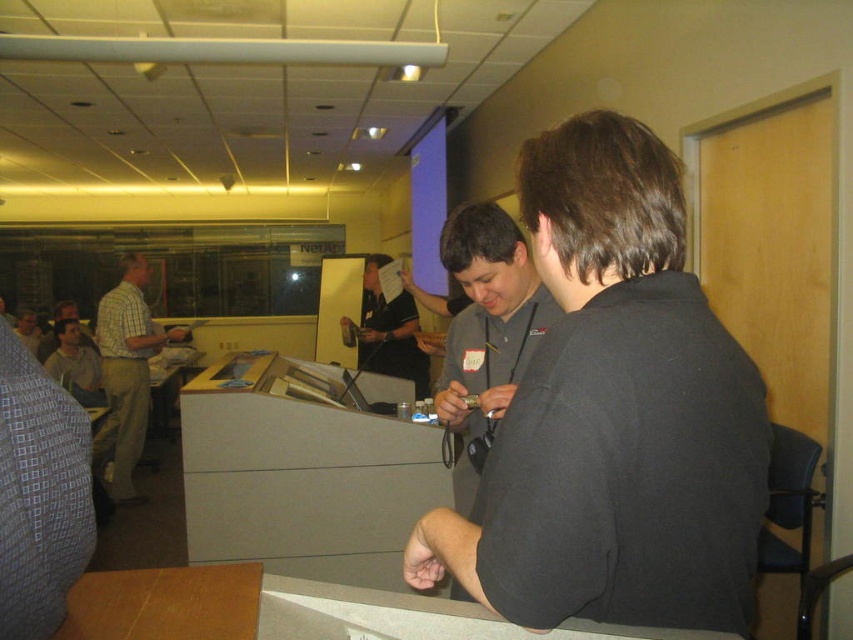
Is black shirt at center to the left of dark gray shirt at center from the viewer's perspective?

In fact, black shirt at center is to the right of dark gray shirt at center.

At what (x,y) coordinates should I click in order to perform the action: click on black shirt at center. Please return your answer as a coordinate pair (x, y). The image size is (853, 640). Looking at the image, I should click on (614, 413).

Does point (653, 344) come closer to viewer compared to point (374, 323)?

Yes, it is in front of point (374, 323).

Identify the location of black shirt at center. (614, 413).

Can you confirm if matte gray shirt at center is positioned above plaid shirt at left?

Correct, matte gray shirt at center is located above plaid shirt at left.

Does matte gray shirt at center appear under plaid shirt at left?

No, matte gray shirt at center is not below plaid shirt at left.

What do you see at coordinates (485, 332) in the screenshot? The width and height of the screenshot is (853, 640). I see `matte gray shirt at center` at bounding box center [485, 332].

This screenshot has width=853, height=640. What are the coordinates of `matte gray shirt at center` in the screenshot? It's located at (485, 332).

Does dark gray shirt at center appear on the left side of light brown shirt at left?

Incorrect, dark gray shirt at center is not on the left side of light brown shirt at left.

Which is above, dark gray shirt at center or light brown shirt at left?

dark gray shirt at center

Does point (372, 266) come behind point (85, 339)?

No.

Identify the location of dark gray shirt at center. (387, 332).